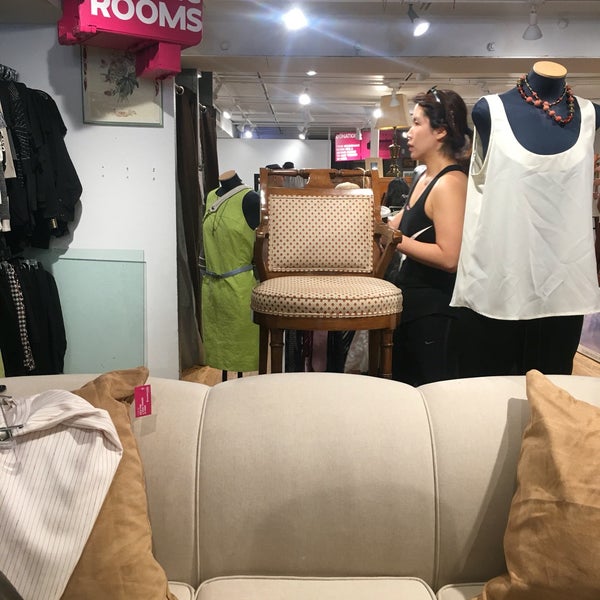
The image size is (600, 600). I want to click on white wall, so click(x=130, y=220).